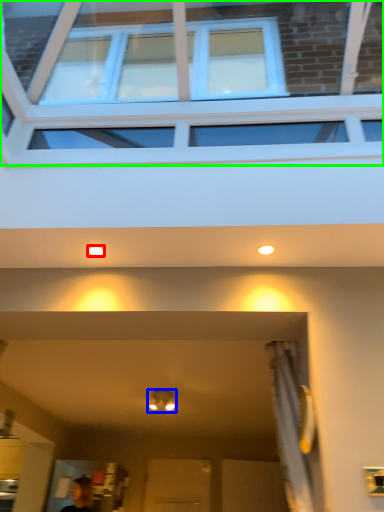
Question: Considering the real-world distances, which object is closest to lighting (highlighted by a red box)? light fixture (highlighted by a blue box) or window (highlighted by a green box).

Choices:
 (A) light fixture
 (B) window

Answer: (B)